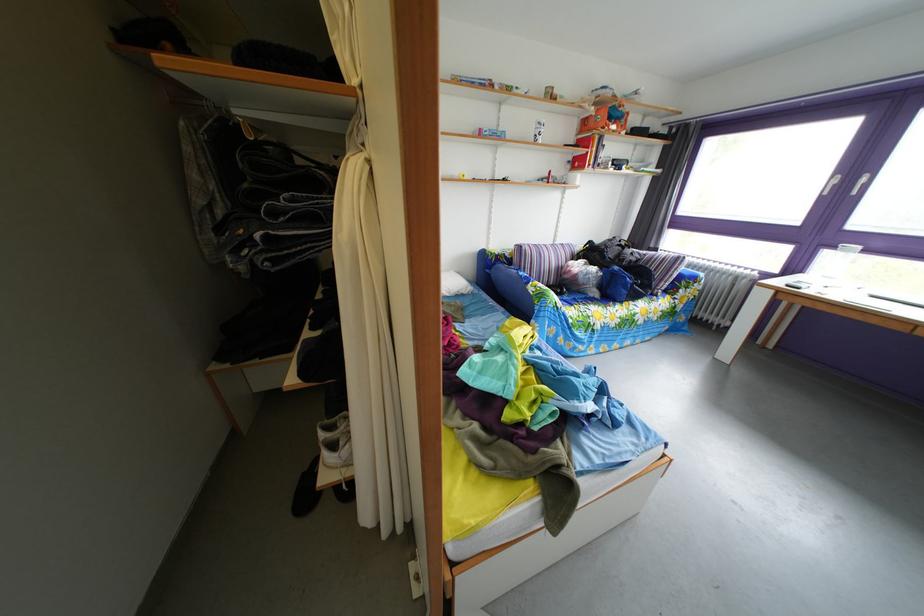
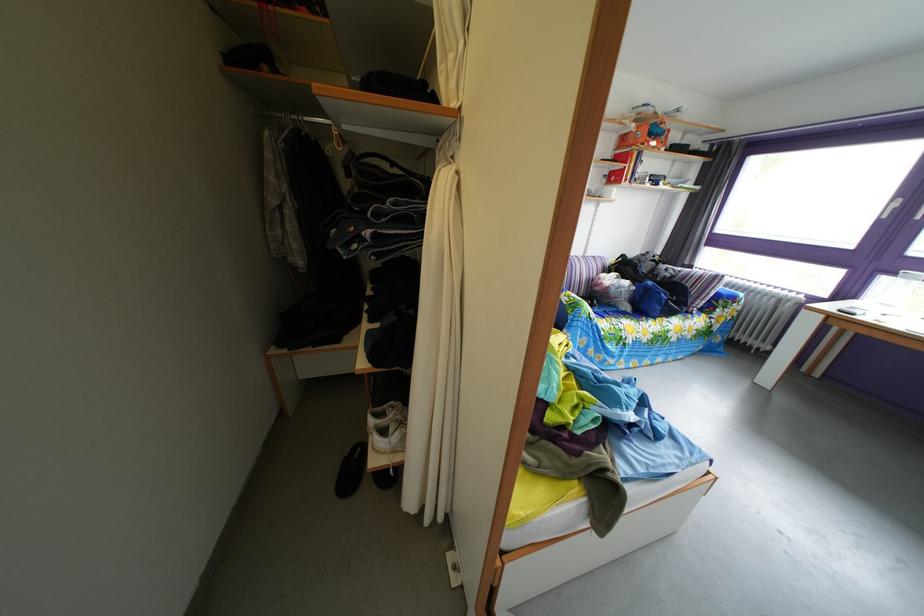
In the second image, find the point that corresponds to the point at 627,276 in the first image.

(661, 291)